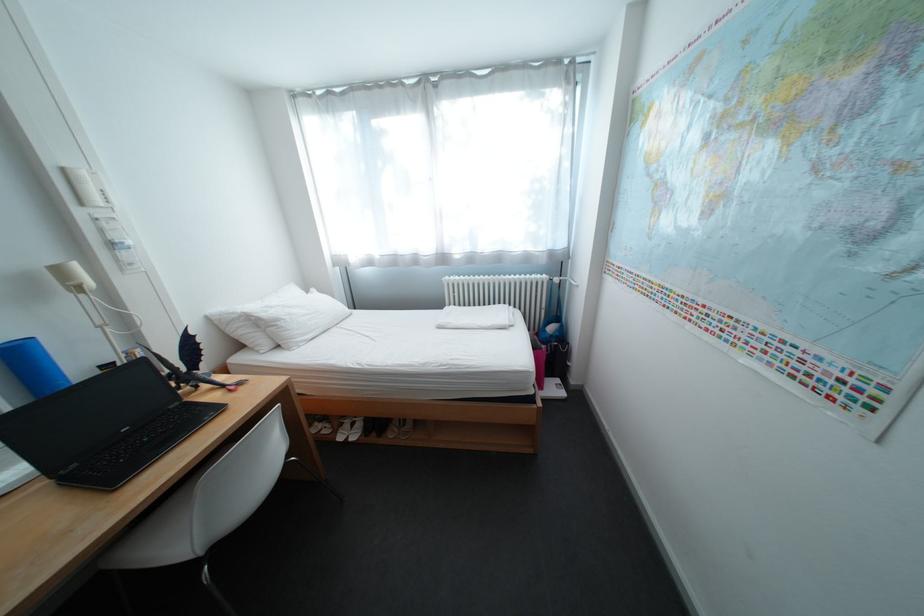
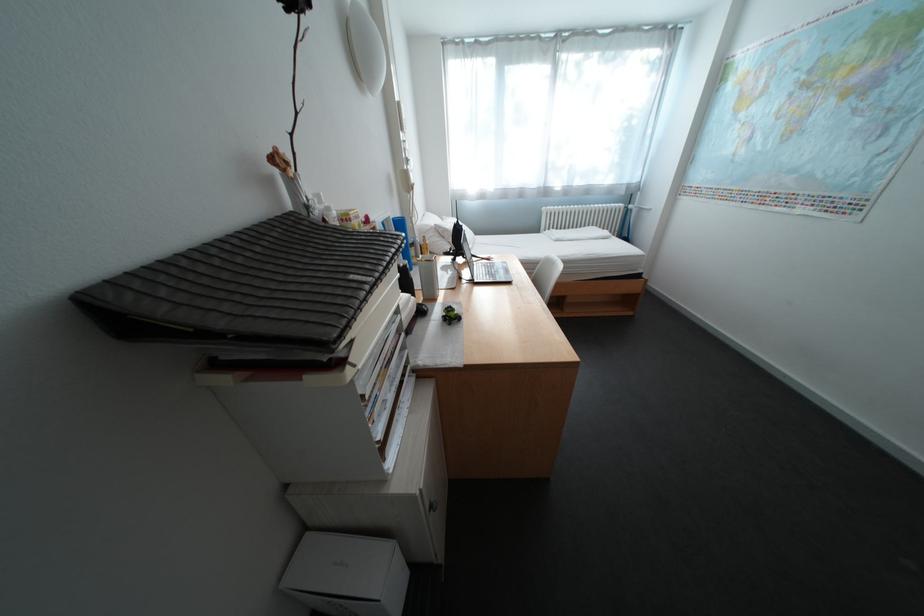
What movement of the cameraman would produce the second image?

The movement direction of the cameraman is left, backward.